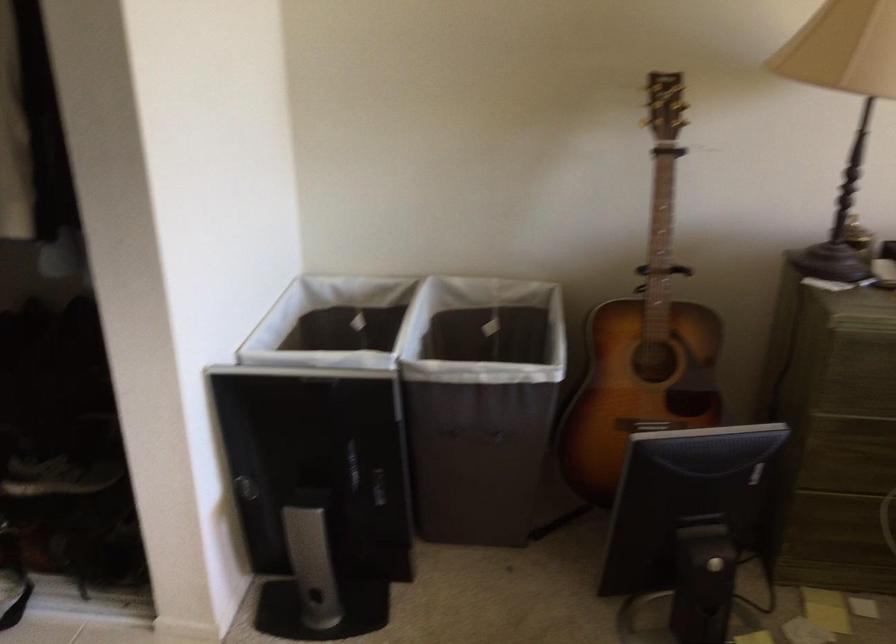
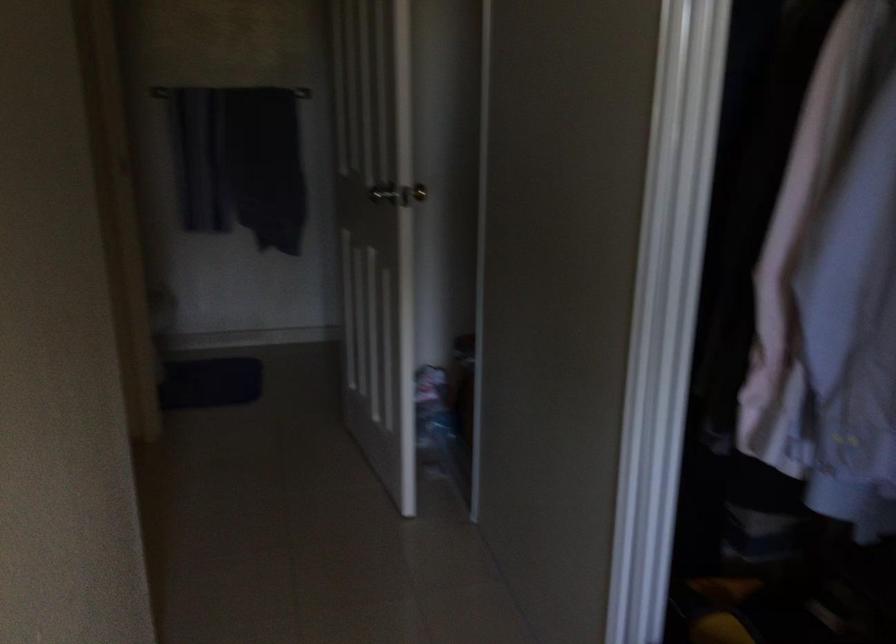
Question: The camera is either moving clockwise (left) or counter-clockwise (right) around the object. The first image is from the beginning of the video and the second image is from the end. Is the camera moving left or right when shooting the video?

Choices:
 (A) Left
 (B) Right

Answer: (B)